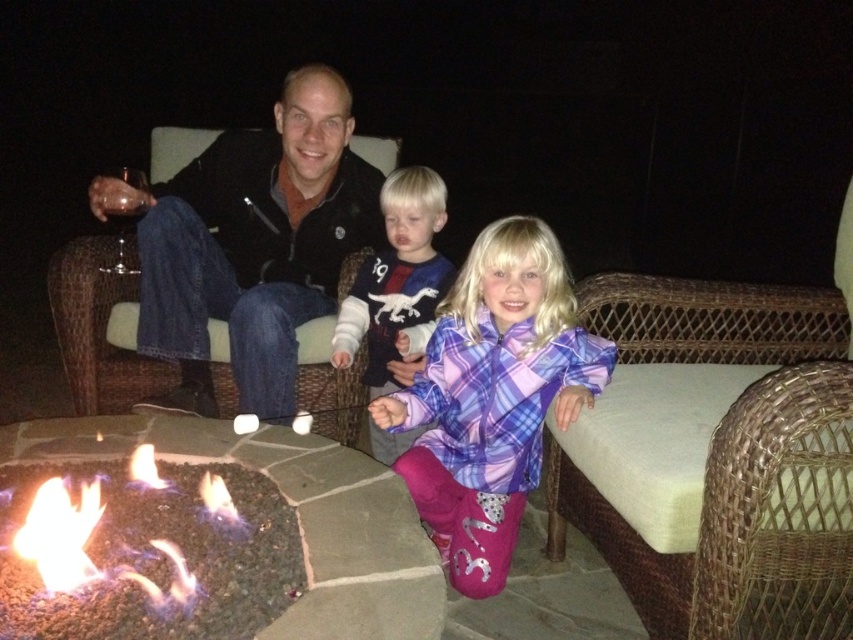
Question: Can you confirm if purple plaid jacket at center is smaller than flamegasfire at lower left?

Choices:
 (A) yes
 (B) no

Answer: (B)

Question: Considering the real-world distances, which object is farthest from the plush fleece sweater at center?

Choices:
 (A) flamegasfire at lower left
 (B) purple plaid jacket at center

Answer: (A)

Question: Is dark blue jeans at center closer to camera compared to plush fleece sweater at center?

Choices:
 (A) yes
 (B) no

Answer: (A)

Question: Does dark blue jeans at center have a lesser width compared to flamegasfire at lower left?

Choices:
 (A) yes
 (B) no

Answer: (B)

Question: Which is nearer to the purple plaid jacket at center?

Choices:
 (A) flamegasfire at lower left
 (B) dark blue jeans at center
 (C) plush fleece sweater at center

Answer: (C)

Question: Which of these objects is positioned farthest from the plush fleece sweater at center?

Choices:
 (A) purple plaid jacket at center
 (B) dark blue jeans at center
 (C) flamegasfire at lower left

Answer: (C)